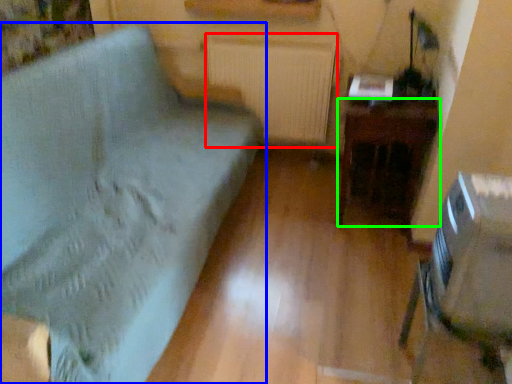
Question: Which object is positioned closest to radiator (highlighted by a red box)? Select from furniture (highlighted by a blue box) and table (highlighted by a green box).

Choices:
 (A) furniture
 (B) table

Answer: (B)